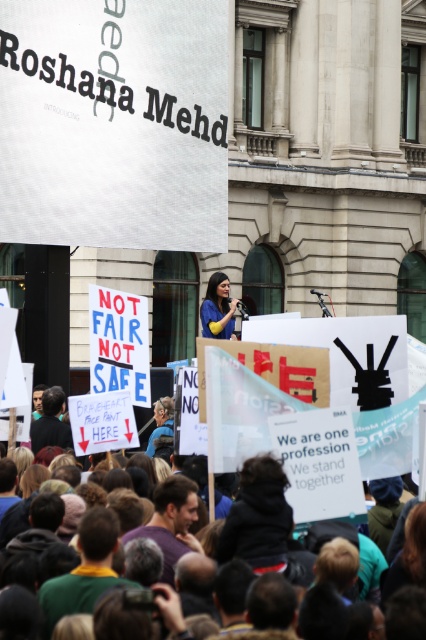
You are a photographer trying to capture the protest scene. You want to ensure both the multicolored fabric crowd at center and the matte blue shirt at center are clearly visible in your shot. Given their sizes, which object should you focus on to ensure both fit in the frame?

The multicolored fabric crowd at center is wider than the matte blue shirt at center, so focusing on the wider multicolored fabric crowd at center would help ensure both fit within the frame.

Based on the scene description, where is the multicolored fabric crowd at center located in the image?

The multicolored fabric crowd at center is located at point [305,440] in the image.